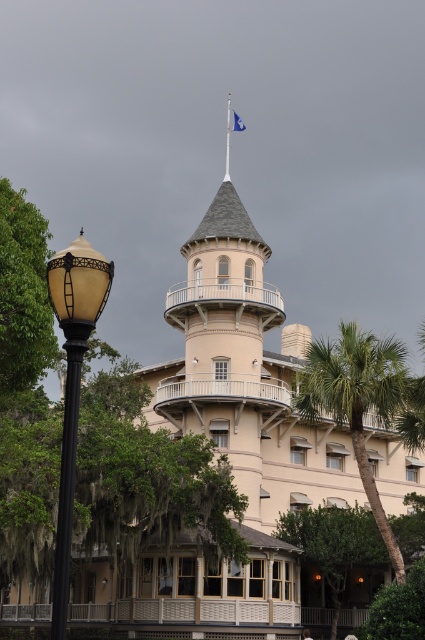
Based on the photo, how much distance is there between green leafy palm tree at center and black polished metal pole at left?

The distance of green leafy palm tree at center from black polished metal pole at left is 44.64 meters.

Does green leafy palm tree at center appear over black polished metal pole at left?

Yes.

Does point (316, 376) come in front of point (76, 401)?

No, (316, 376) is further to viewer.

Locate an element on the screen. The height and width of the screenshot is (640, 425). green leafy palm tree at center is located at coordinates point(365,403).

Does black polished metal pole at left have a greater height compared to blue fabric flagpole at top?

In fact, black polished metal pole at left may be shorter than blue fabric flagpole at top.

Does black polished metal pole at left have a smaller size compared to blue fabric flagpole at top?

Indeed, black polished metal pole at left has a smaller size compared to blue fabric flagpole at top.

You are a GUI agent. You are given a task and a screenshot of the screen. Output one action in this format:
    pyautogui.click(x=<x>, y=<y>)
    Task: Click on the black polished metal pole at left
    The image size is (425, 640).
    Given the screenshot: What is the action you would take?
    pyautogui.click(x=67, y=474)

Is matte black lamp post at left positioned before blue fabric flagpole at top?

Yes, it is in front of blue fabric flagpole at top.

Who is positioned more to the left, matte black lamp post at left or blue fabric flagpole at top?

From the viewer's perspective, matte black lamp post at left appears more on the left side.

The height and width of the screenshot is (640, 425). What do you see at coordinates (73, 385) in the screenshot? I see `matte black lamp post at left` at bounding box center [73, 385].

Locate an element on the screen. The image size is (425, 640). matte black lamp post at left is located at coordinates (73, 385).